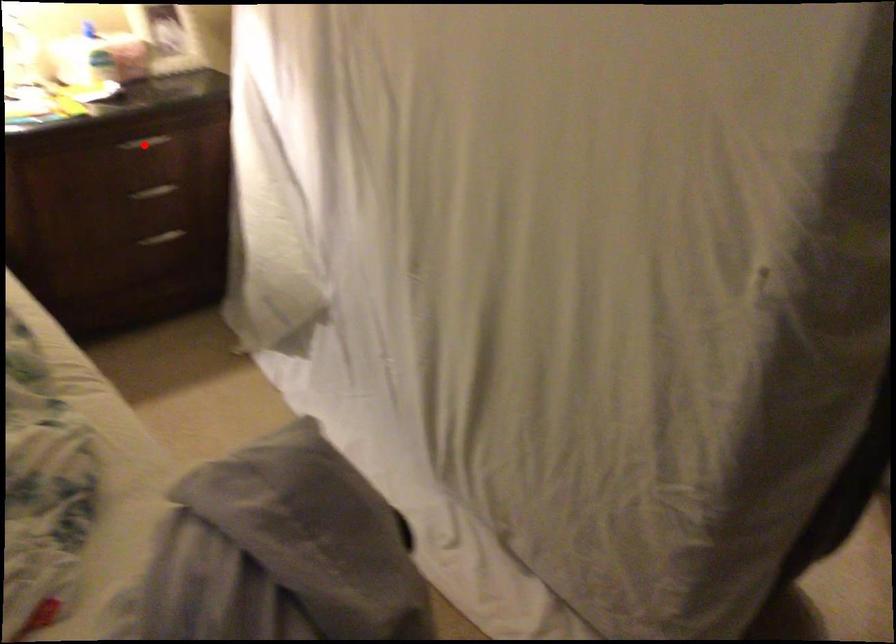
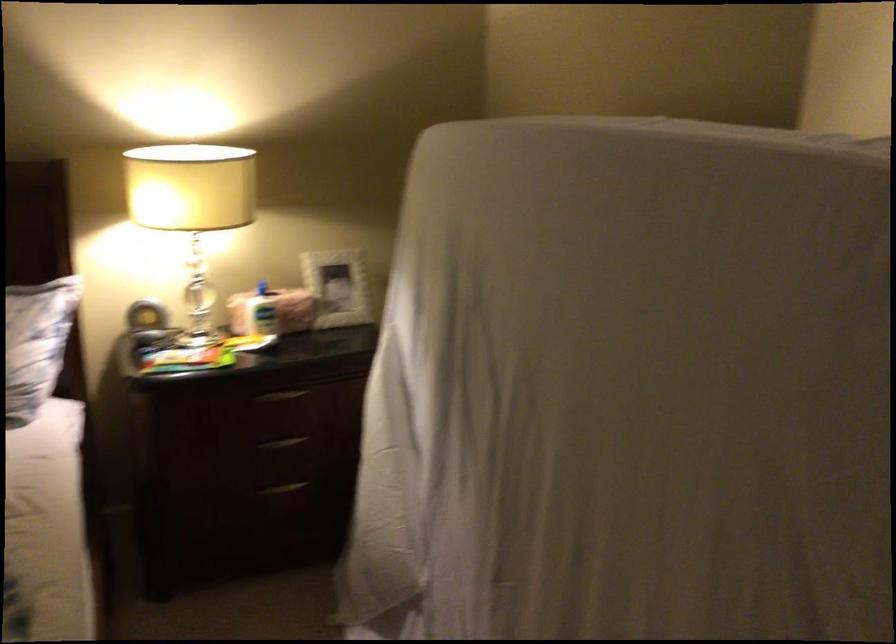
In the second image, find the point that corresponds to the highlighted location in the first image.

(280, 395)